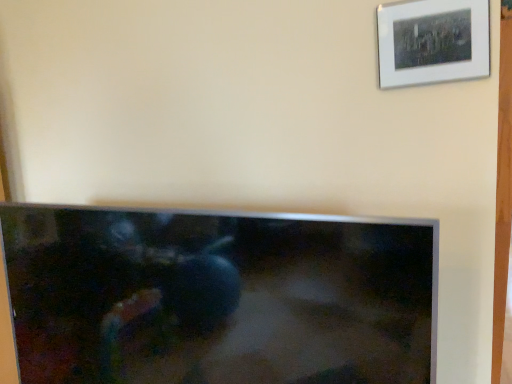
Question: Relative to matte black tv at center, is white matte picture frame at upper right in front or behind?

Choices:
 (A) behind
 (B) front

Answer: (A)

Question: Is white matte picture frame at upper right to the left or to the right of matte black tv at center in the image?

Choices:
 (A) left
 (B) right

Answer: (B)

Question: Does point (450, 13) appear closer or farther from the camera than point (23, 278)?

Choices:
 (A) closer
 (B) farther

Answer: (A)

Question: From a real-world perspective, is matte black tv at center above or below white matte picture frame at upper right?

Choices:
 (A) below
 (B) above

Answer: (A)

Question: Is matte black tv at center in front of or behind white matte picture frame at upper right in the image?

Choices:
 (A) front
 (B) behind

Answer: (A)

Question: From the image's perspective, relative to white matte picture frame at upper right, is matte black tv at center above or below?

Choices:
 (A) above
 (B) below

Answer: (B)

Question: Is matte black tv at center to the left or to the right of white matte picture frame at upper right in the image?

Choices:
 (A) left
 (B) right

Answer: (A)